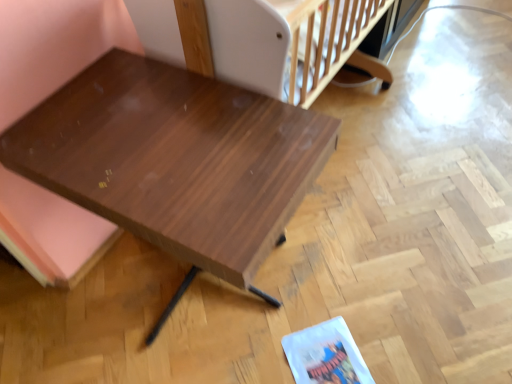
The height and width of the screenshot is (384, 512). In order to click on vacant space in shiny brown wood table at center (from a real-world perspective) in this screenshot , I will do `click(192, 294)`.